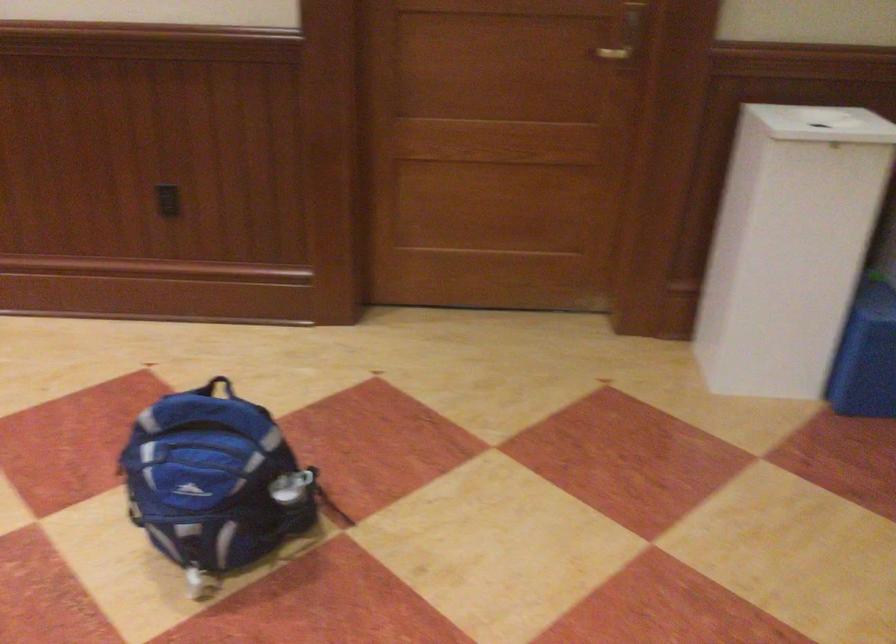
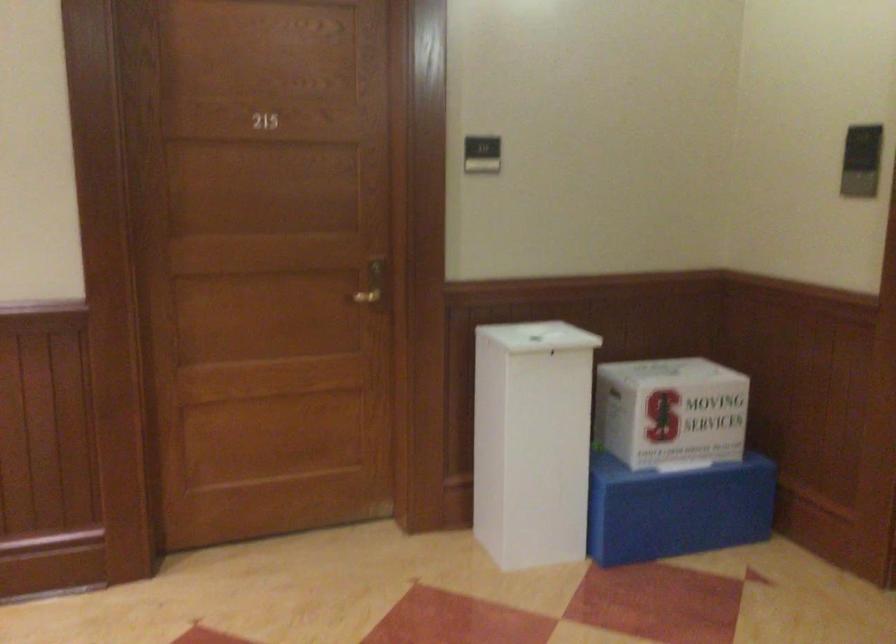
In a continuous first-person perspective shot, in which direction is the camera moving?

The movement direction of the cameraman is left, backward.